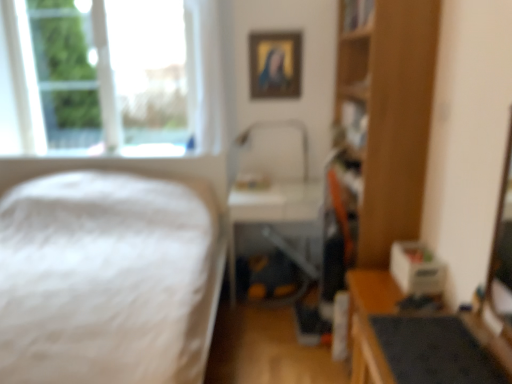
What do you see at coordinates (110, 78) in the screenshot? The height and width of the screenshot is (384, 512). I see `transparent glass window at upper left` at bounding box center [110, 78].

Measure the distance between metallic gray table at center and camera.

The distance of metallic gray table at center from camera is 9.10 feet.

Image resolution: width=512 pixels, height=384 pixels. Describe the element at coordinates (390, 116) in the screenshot. I see `wooden bookshelf at right` at that location.

The image size is (512, 384). What do you see at coordinates (108, 279) in the screenshot?
I see `white fluffy bed at left` at bounding box center [108, 279].

Identify the location of gold-framed portrait at upper center. The image size is (512, 384). (275, 64).

Locate an element on the screen. The image size is (512, 384). wooden table at lower right is located at coordinates (411, 337).

Measure the distance between wooden bookshelf at right and gold-framed portrait at upper center.

wooden bookshelf at right and gold-framed portrait at upper center are 1.05 meters apart.

From a real-world perspective, is wooden bookshelf at right located higher than gold-framed portrait at upper center?

No.

Is wooden bookshelf at right in front of or behind gold-framed portrait at upper center in the image?

Visually, wooden bookshelf at right is located in front of gold-framed portrait at upper center.

Where is `bookshelf below the gold-framed portrait at upper center (from the image's perspective)`? The height and width of the screenshot is (384, 512). bookshelf below the gold-framed portrait at upper center (from the image's perspective) is located at coordinates (390, 116).

Is point (184, 34) farther from camera compared to point (298, 96)?

That is True.

Locate an element on the screen. picture frame on the right of transparent glass window at upper left is located at coordinates [275, 64].

From the image's perspective, between transparent glass window at upper left and gold-framed portrait at upper center, which one is located above?

transparent glass window at upper left is shown above in the image.

Can you confirm if transparent glass window at upper left is positioned to the right of gold-framed portrait at upper center?

No.

Could you tell me if wooden table at lower right is turned towards white fluffy bed at left?

Yes, wooden table at lower right is aimed at white fluffy bed at left.

Would you say wooden table at lower right is to the left or to the right of white fluffy bed at left in the picture?

Clearly, wooden table at lower right is on the right of white fluffy bed at left in the image.

Can we say wooden table at lower right lies outside white fluffy bed at left?

Yes, wooden table at lower right is located beyond the bounds of white fluffy bed at left.

Considering the sizes of wooden table at lower right and white fluffy bed at left in the image, is wooden table at lower right taller or shorter than white fluffy bed at left?

Considering their sizes, wooden table at lower right has less height than white fluffy bed at left.

Choose the correct answer: Is white fluffy bed at left inside wooden table at lower right or outside it?

white fluffy bed at left lies outside wooden table at lower right.

Would you consider white fluffy bed at left to be distant from wooden table at lower right?

white fluffy bed at left is far away from wooden table at lower right.

Is point (118, 288) in front of point (510, 371)?

No, (118, 288) is further to viewer.

From a real-world perspective, which object rests below the other?

In real-world perspective, wooden table at lower right is lower.

Is metallic gray table at center situated inside transparent glass window at upper left or outside?

metallic gray table at center is outside transparent glass window at upper left.

Looking at this image, considering the relative positions of metallic gray table at center and transparent glass window at upper left in the image provided, is metallic gray table at center in front of transparent glass window at upper left?

Yes, metallic gray table at center is closer to the viewer.

Which object is further away from the camera taking this photo, metallic gray table at center or wooden bookshelf at right?

metallic gray table at center is further from the camera.

Between metallic gray table at center and wooden bookshelf at right, which one has larger size?

wooden bookshelf at right.

The width and height of the screenshot is (512, 384). What are the coordinates of `bookshelf on the right of the metallic gray table at center` in the screenshot? It's located at (390, 116).

From the image's perspective, is metallic gray table at center on wooden bookshelf at right?

Incorrect, from the image's perspective, metallic gray table at center is lower than wooden bookshelf at right.

Does wooden bookshelf at right appear on the right side of white fluffy bed at left?

Yes, wooden bookshelf at right is to the right of white fluffy bed at left.

Does wooden bookshelf at right turn towards white fluffy bed at left?

Yes, wooden bookshelf at right faces towards white fluffy bed at left.

Measure the distance between wooden bookshelf at right and white fluffy bed at left.

4.55 feet.

Which is closer, (382, 132) or (12, 204)?

The point (382, 132) is more forward.

The height and width of the screenshot is (384, 512). In order to click on picture frame that appears on the left of wooden bookshelf at right in this screenshot , I will do `click(275, 64)`.

I want to click on window behind the gold-framed portrait at upper center, so click(x=110, y=78).

Based on their spatial positions, is white fluffy bed at left or wooden table at lower right closer to transparent glass window at upper left?

white fluffy bed at left is positioned closer to the anchor transparent glass window at upper left.

Considering their positions, is transparent glass window at upper left positioned further to gold-framed portrait at upper center than white fluffy bed at left?

white fluffy bed at left is further to gold-framed portrait at upper center.

Based on the photo, when comparing their distances from wooden bookshelf at right, does transparent glass window at upper left or wooden table at lower right seem closer?

wooden table at lower right is positioned closer to the anchor wooden bookshelf at right.

From the picture: Estimate the real-world distances between objects in this image. Which object is further from gold-framed portrait at upper center, white fluffy bed at left or wooden table at lower right?

wooden table at lower right is further to gold-framed portrait at upper center.

Which object lies nearer to the anchor point gold-framed portrait at upper center, metallic gray table at center or wooden table at lower right?

metallic gray table at center.

Based on the photo, from the image, which object appears to be farther from wooden bookshelf at right, white fluffy bed at left or transparent glass window at upper left?

transparent glass window at upper left is positioned further to the anchor wooden bookshelf at right.

Based on their spatial positions, is metallic gray table at center or wooden bookshelf at right closer to gold-framed portrait at upper center?

Based on the image, metallic gray table at center appears to be nearer to gold-framed portrait at upper center.

Considering their positions, is gold-framed portrait at upper center positioned closer to metallic gray table at center than transparent glass window at upper left?

Among the two, gold-framed portrait at upper center is located nearer to metallic gray table at center.

Where is `workbench situated between white fluffy bed at left and wooden bookshelf at right from left to right`? The width and height of the screenshot is (512, 384). workbench situated between white fluffy bed at left and wooden bookshelf at right from left to right is located at coordinates (411, 337).

Where is `table between transparent glass window at upper left and wooden bookshelf at right`? The height and width of the screenshot is (384, 512). table between transparent glass window at upper left and wooden bookshelf at right is located at coordinates (276, 219).

The height and width of the screenshot is (384, 512). I want to click on table located between white fluffy bed at left and wooden table at lower right in the left-right direction, so click(x=276, y=219).

Locate an element on the screen. Image resolution: width=512 pixels, height=384 pixels. table between white fluffy bed at left and wooden bookshelf at right is located at coordinates (276, 219).